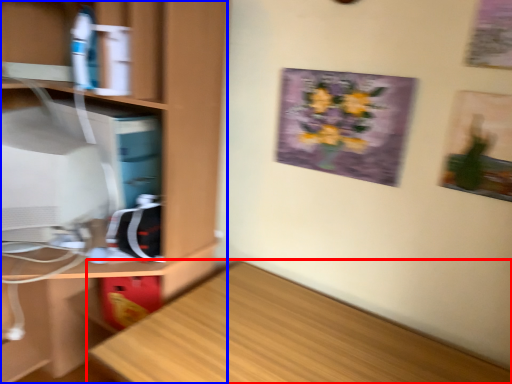
Question: Which point is further to the camera, desk (highlighted by a red box) or cabinetry (highlighted by a blue box)?

Choices:
 (A) desk
 (B) cabinetry

Answer: (B)